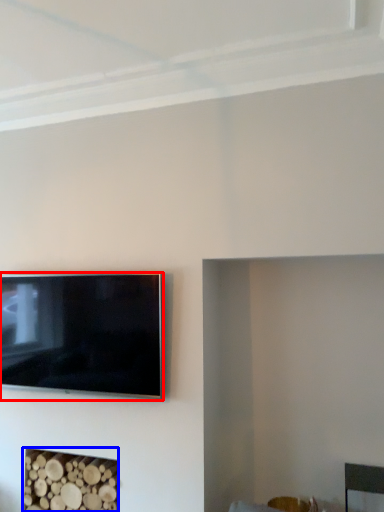
Question: Which object appears closest to the camera in this image, television (highlighted by a red box) or fireplace (highlighted by a blue box)?

Choices:
 (A) television
 (B) fireplace

Answer: (A)